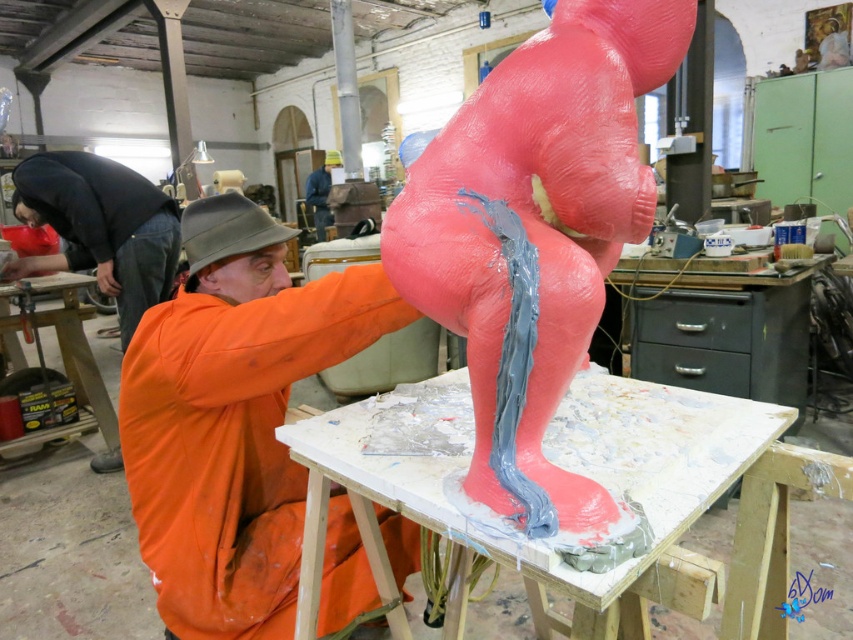
You are standing in the workshop and see the point at coordinates (535, 236). Which object is this point located on?

The point at coordinates (535, 236) is located on the rubbery pink sculpture at center.

You are standing in the workshop and want to reach the point at coordinates point (468, 173). If your arm can extend 30 inches, can you reach it?

The point (468, 173) is 33.06 inches away from the viewer. Since your arm can only extend 30 inches, you cannot reach it.